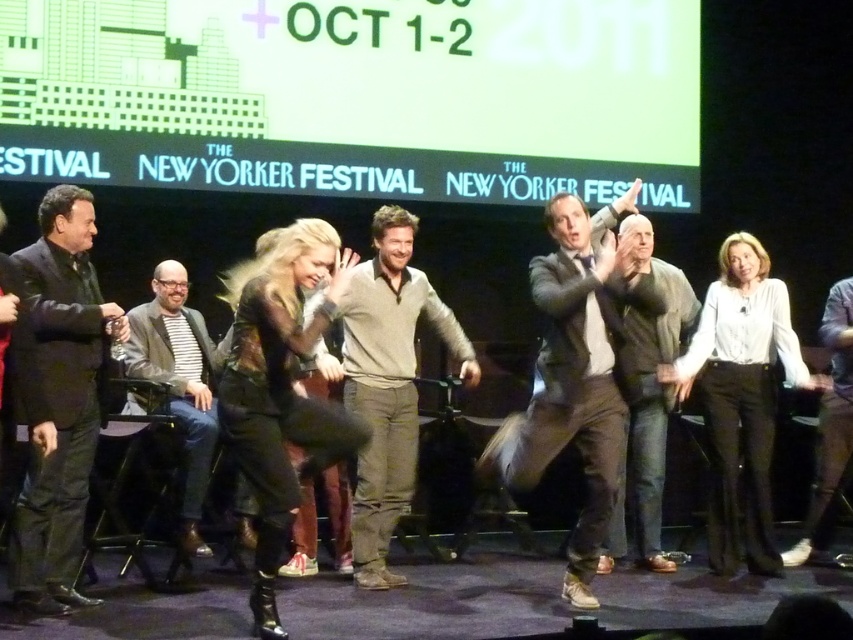
You are a photographer at the New Yorker Festival event. You need to position yourself to capture both the black suit at left and the white cotton blouse at center in the same frame. Based on their positions, which direction should you face to include both subjects?

You should face towards the center where the white cotton blouse at center is located, as the black suit at left is positioned to the left of it, ensuring both are within the frame when centered on the blouse.

You are organizing a photo shoot and need to arrange the black suit at left and the light brown sweater at center based on their widths. Which one should you place on the narrower side of the frame?

The black suit at left has a smaller width than the light brown sweater at center, so you should place the black suit at left on the narrower side of the frame.